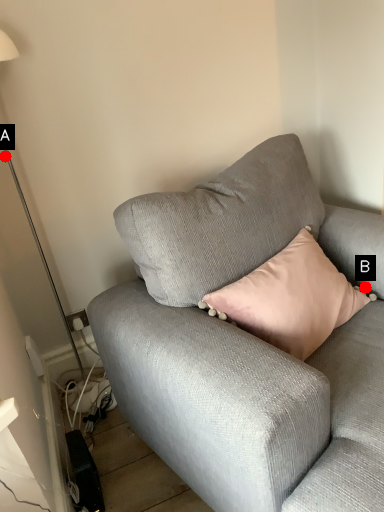
Question: Two points are circled on the image, labeled by A and B beside each circle. Which of the following is the closest to the observer?

Choices:
 (A) A is closer
 (B) B is closer

Answer: (B)